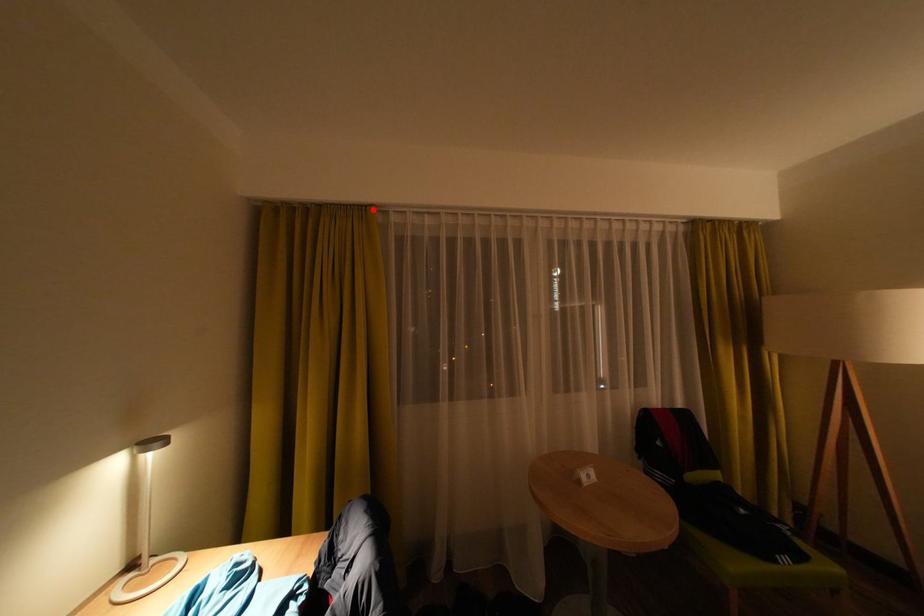
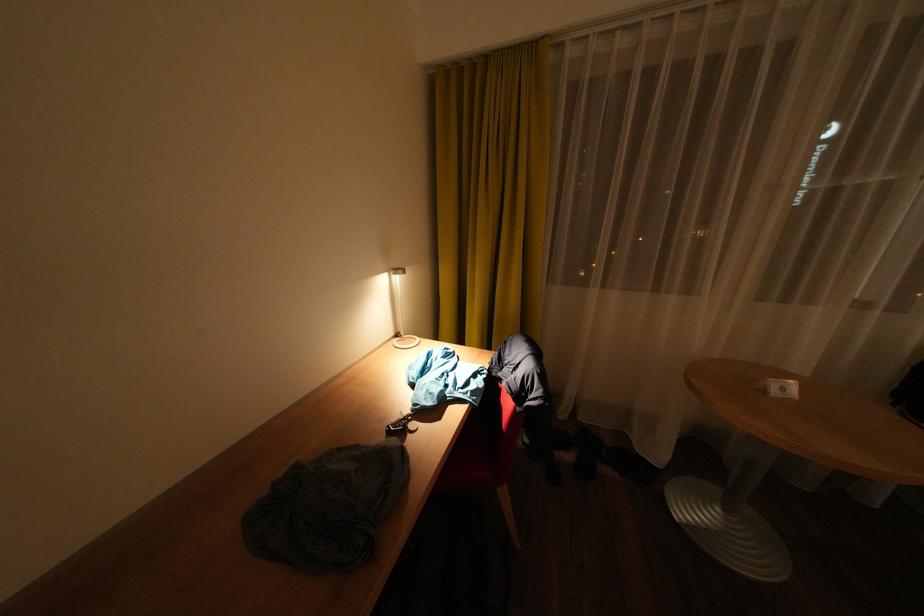
Question: I am providing you with two images of the same scene from different viewpoints. A red point is marked on the first image. Is the red point's position out of view in image 2?

Choices:
 (A) Yes
 (B) No

Answer: (B)